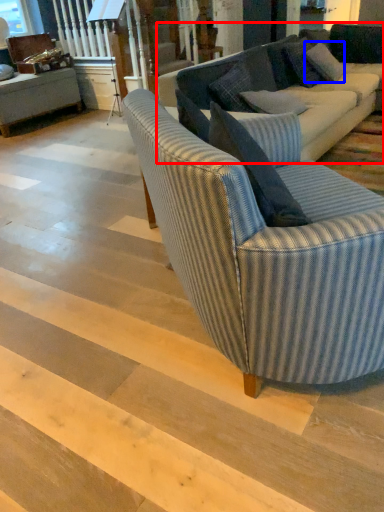
Question: Among these objects, which one is farthest to the camera, studio couch (highlighted by a red box) or pillow (highlighted by a blue box)?

Choices:
 (A) studio couch
 (B) pillow

Answer: (B)